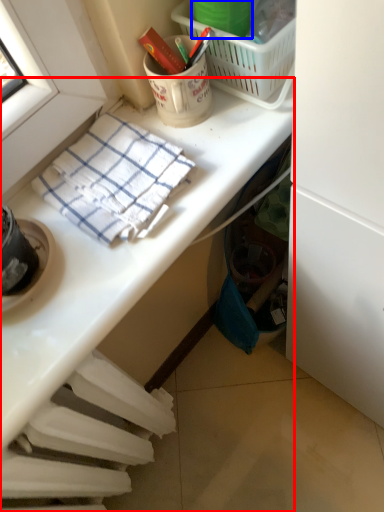
Question: Which object is further to the camera taking this photo, desk (highlighted by a red box) or bucket (highlighted by a blue box)?

Choices:
 (A) desk
 (B) bucket

Answer: (B)